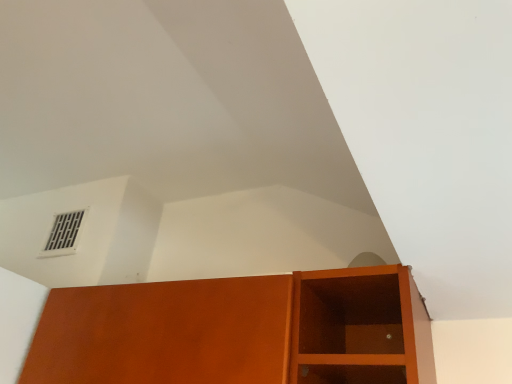
Describe the element at coordinates (64, 234) in the screenshot. I see `white plastic air conditioner at upper left` at that location.

This screenshot has width=512, height=384. I want to click on white plastic air conditioner at upper left, so click(64, 234).

Identify the location of white plastic air conditioner at upper left. The height and width of the screenshot is (384, 512). (64, 234).